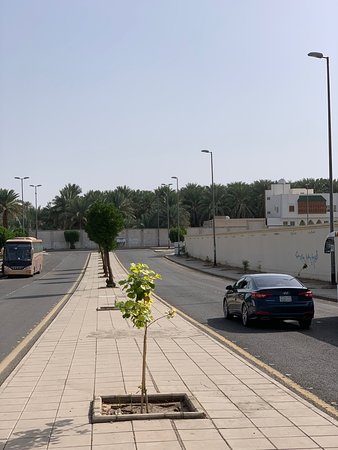
Image resolution: width=338 pixels, height=450 pixels. Find the location of `paper sign notification`. paper sign notification is located at coordinates 330,242.